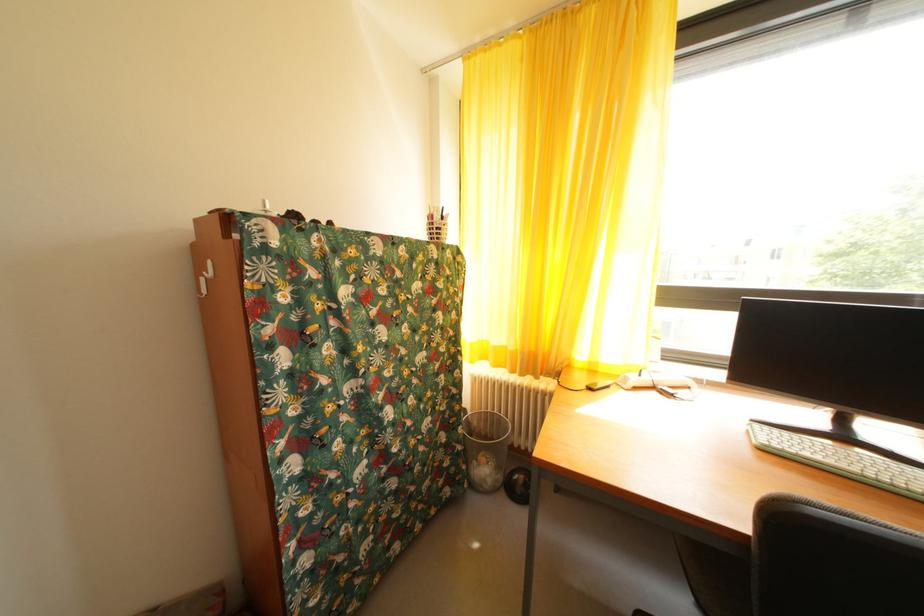
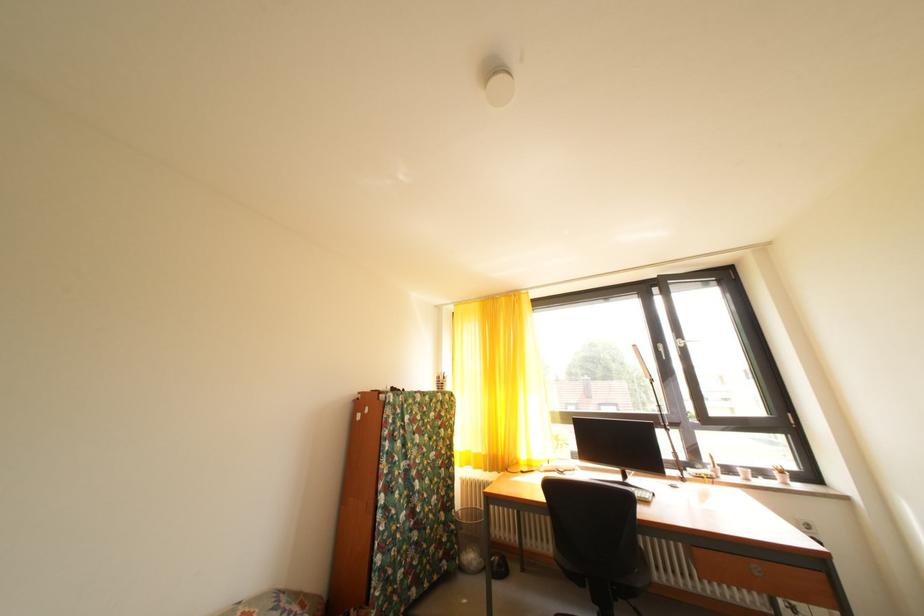
Question: What movement of the cameraman would produce the second image?

Choices:
 (A) Left
 (B) Right
 (C) Forward
 (D) Backward

Answer: (D)